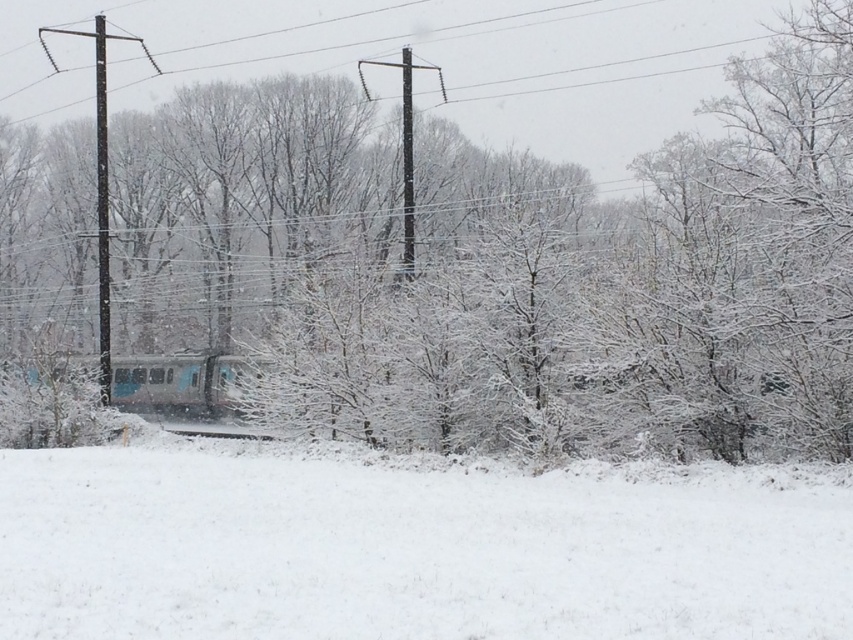
Is white fluffy snow at lower center taller than black wooden telegraph pole at left?

No, white fluffy snow at lower center is not taller than black wooden telegraph pole at left.

Does white fluffy snow at lower center have a lesser width compared to black wooden telegraph pole at left?

Yes.

Where is `white fluffy snow at lower center`? The width and height of the screenshot is (853, 640). white fluffy snow at lower center is located at coordinates (410, 548).

Consider the image. Who is lower down, white fluffy snow at lower center or smooth concrete train track at center?

smooth concrete train track at center

Measure the distance from white fluffy snow at lower center to smooth concrete train track at center.

They are 14.55 meters apart.

The image size is (853, 640). I want to click on white fluffy snow at lower center, so click(410, 548).

Between point (99, 342) and point (218, 436), which one is positioned in front?

Point (218, 436) is more forward.

Is black wooden telegraph pole at left to the left of smooth concrete train track at center from the viewer's perspective?

Indeed, black wooden telegraph pole at left is positioned on the left side of smooth concrete train track at center.

Is point (102, 164) positioned before point (210, 428)?

That is True.

This screenshot has width=853, height=640. In order to click on black wooden telegraph pole at left in this screenshot , I will do `click(100, 180)`.